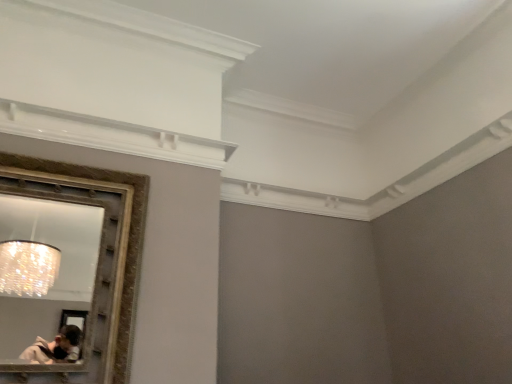
Measure the distance between gold textured mirror at left and camera.

A distance of 4.15 meters exists between gold textured mirror at left and camera.

Where is `gold textured mirror at left`? Image resolution: width=512 pixels, height=384 pixels. gold textured mirror at left is located at coordinates [x=59, y=270].

Describe the element at coordinates (59, 270) in the screenshot. This screenshot has height=384, width=512. I see `gold textured mirror at left` at that location.

At what (x,y) coordinates should I click in order to perform the action: click on gold textured mirror at left. Please return your answer as a coordinate pair (x, y). Looking at the image, I should click on (59, 270).